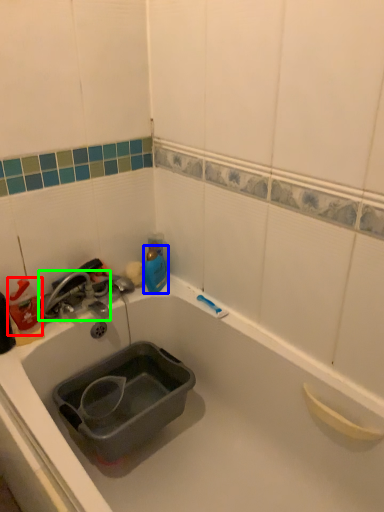
Question: Estimate the real-world distances between objects in this image. Which object is farther from cleaning product (highlighted by a red box), bottle (highlighted by a blue box) or tap (highlighted by a green box)?

Choices:
 (A) bottle
 (B) tap

Answer: (A)